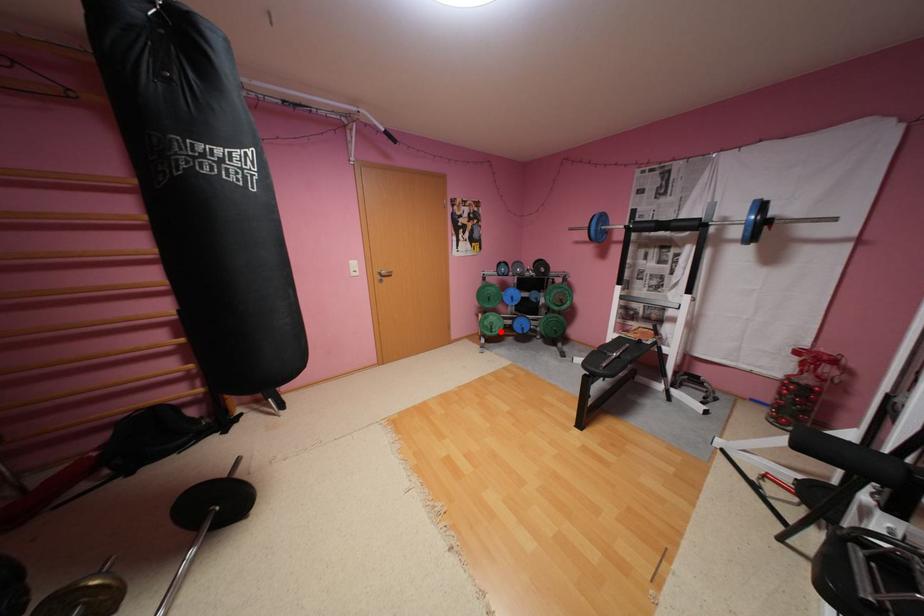
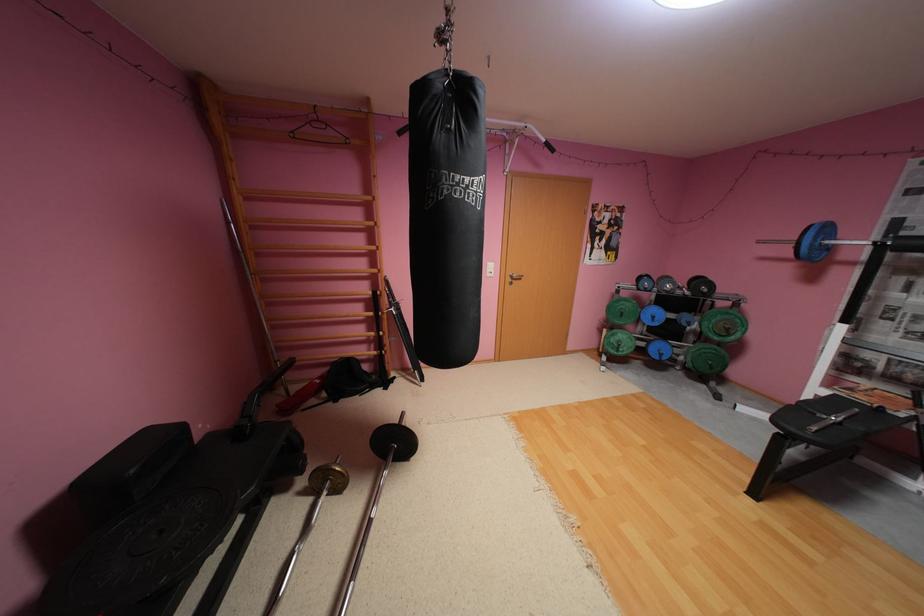
Question: I am providing you with two images of the same scene from different viewpoints. In image1, a red point is highlighted. Considering the same 3D point in image2, which of the following is correct?

Choices:
 (A) It is closer
 (B) It is farther

Answer: (A)